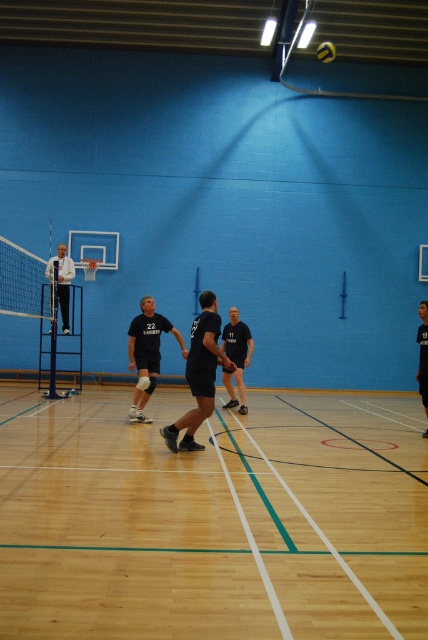
Does black matte jersey at center have a greater height compared to white matte jacket at left?

Yes.

Is point (205, 401) less distant than point (62, 272)?

Yes, point (205, 401) is in front of point (62, 272).

In order to click on black matte jersey at center in this screenshot , I will do `click(199, 374)`.

Can you confirm if black matte/vinyl shorts at center is shorter than yellow matte volleyball at center?

No.

Is black matte/vinyl shorts at center smaller than yellow matte volleyball at center?

No, black matte/vinyl shorts at center is not smaller than yellow matte volleyball at center.

Find the location of a particular element. Image resolution: width=428 pixels, height=640 pixels. black matte/vinyl shorts at center is located at coordinates (146, 353).

Locate an element on the screen. black matte/vinyl shorts at center is located at coordinates (146, 353).

Who is shorter, wooden floor at center or white matte jacket at left?

wooden floor at center is shorter.

The width and height of the screenshot is (428, 640). Describe the element at coordinates (213, 518) in the screenshot. I see `wooden floor at center` at that location.

What are the coordinates of `wooden floor at center` in the screenshot? It's located at (213, 518).